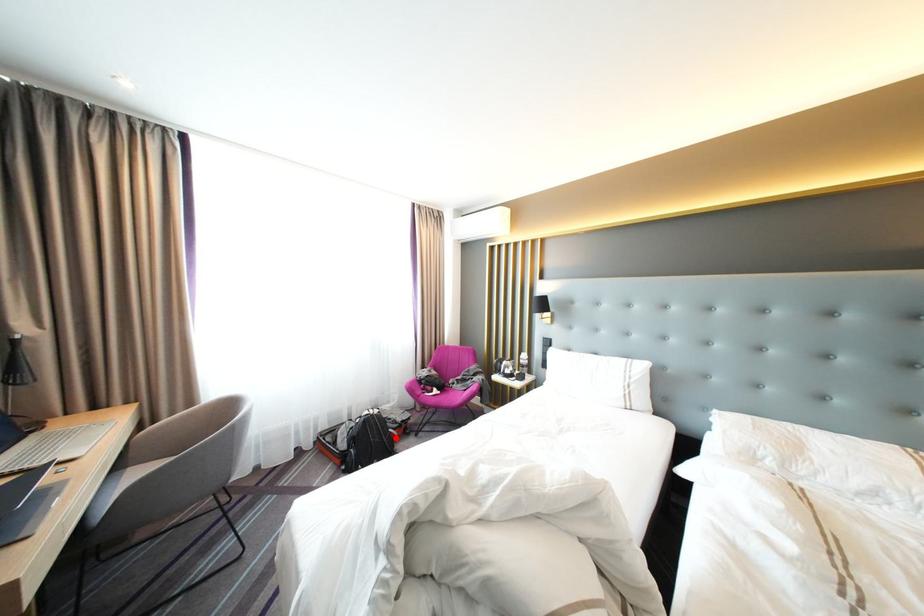
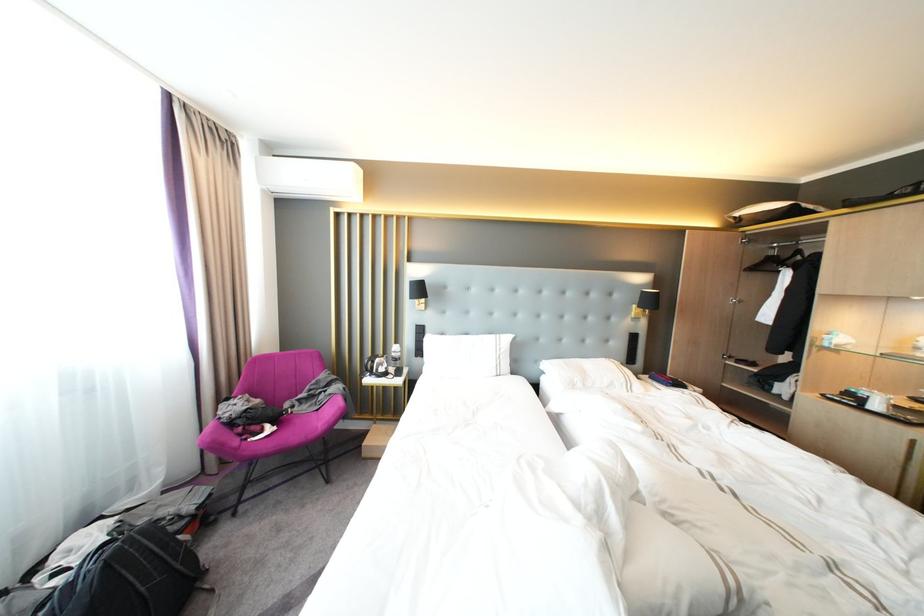
Question: I am providing you with two images of the same scene from different viewpoints. In image1, a red point is highlighted. Considering the same 3D point in image2, which of the following is correct?

Choices:
 (A) It is closer
 (B) It is farther

Answer: (B)